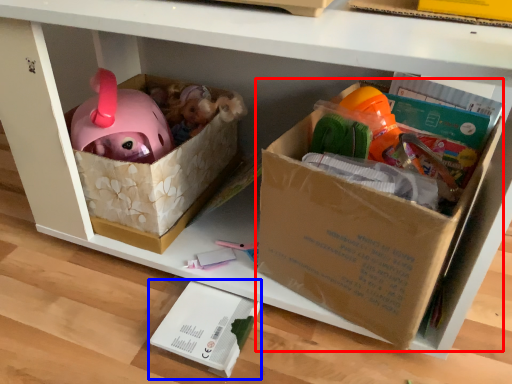
Question: Which object appears closest to the camera in this image, cardboard box (highlighted by a red box) or box (highlighted by a blue box)?

Choices:
 (A) cardboard box
 (B) box

Answer: (A)